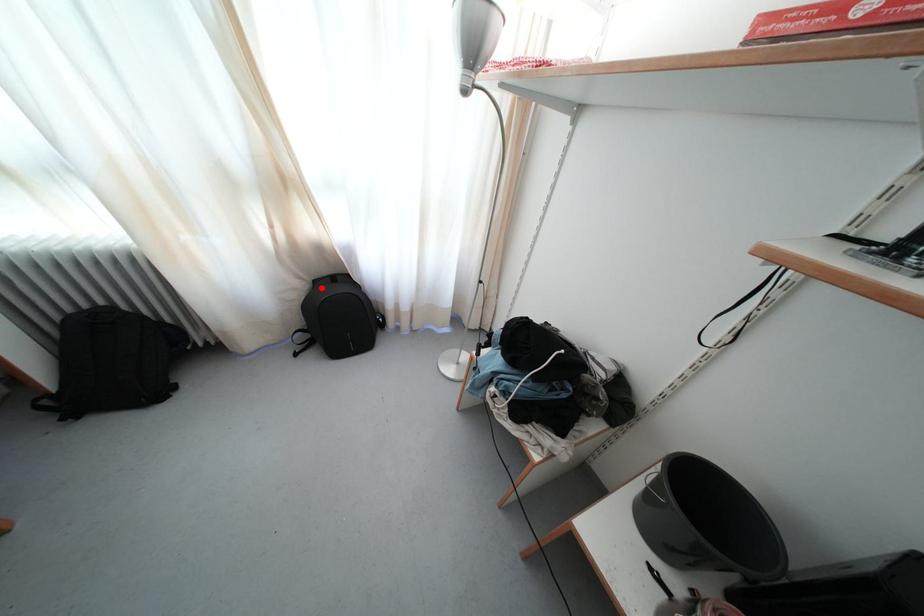
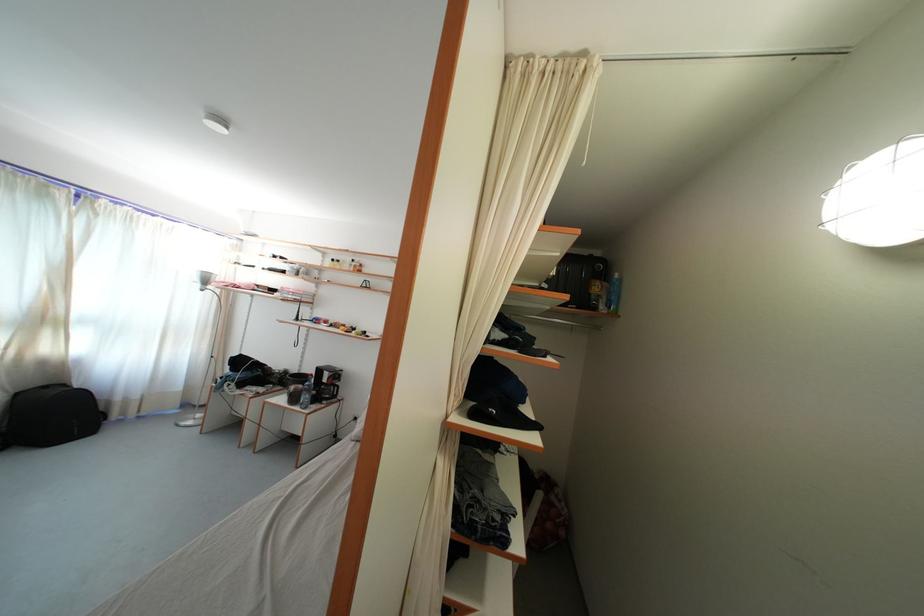
Question: A red point is marked in image1. In image2, is the corresponding 3D point closer to the camera or farther? Reply with the corresponding letter.

Choices:
 (A) The corresponding 3D point is closer.
 (B) The corresponding 3D point is farther.

Answer: (B)